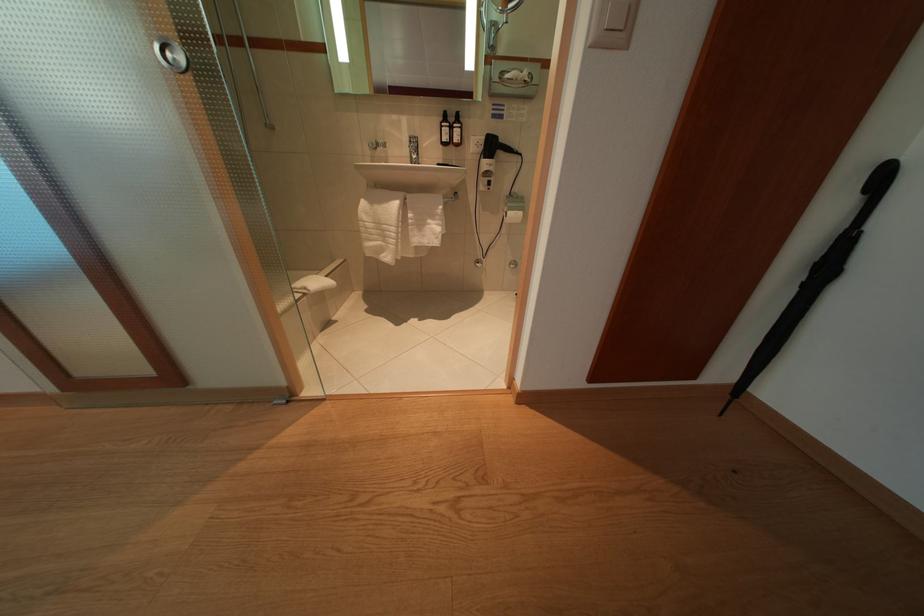
What do you see at coordinates (613, 23) in the screenshot?
I see `the white light switch` at bounding box center [613, 23].